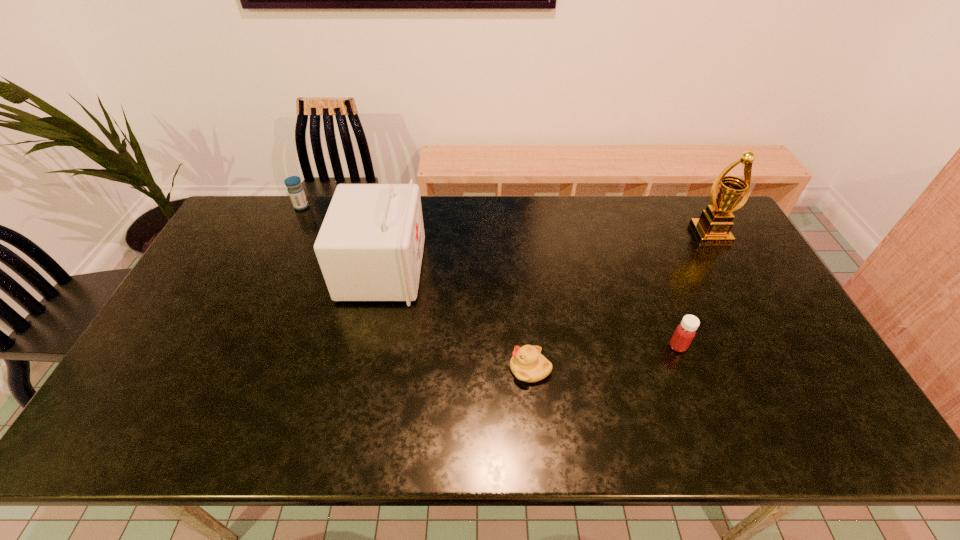
The height and width of the screenshot is (540, 960). I want to click on vacant area located 0.110m on the front of the left medicine, so click(290, 231).

This screenshot has height=540, width=960. Identify the location of free location located 0.280m on the right of the right medicine. (792, 346).

You are a GUI agent. You are given a task and a screenshot of the screen. Output one action in this format:
    pyautogui.click(x=<x>, y=<y>)
    Task: Click on the free space located 0.260m on the front-facing side of the third object from right to left
    
    Given the screenshot: What is the action you would take?
    pyautogui.click(x=408, y=369)

The width and height of the screenshot is (960, 540). What are the coordinates of `vacant space located on the front-facing side of the third object from right to left` in the screenshot? It's located at coord(404,369).

Locate an element on the screen. vacant area situated on the front-facing side of the third object from right to left is located at coordinates (400, 369).

Find the location of a particular element. award that is at the far edge is located at coordinates (713, 227).

Where is `the first-aid kit situated at the far edge`? The width and height of the screenshot is (960, 540). the first-aid kit situated at the far edge is located at coordinates (370, 246).

Image resolution: width=960 pixels, height=540 pixels. What are the coordinates of `medicine that is at the far edge` in the screenshot? It's located at (296, 192).

This screenshot has width=960, height=540. In order to click on object that is at the right edge in this screenshot , I will do `click(713, 227)`.

The width and height of the screenshot is (960, 540). Identify the location of object present at the far right corner. (713, 227).